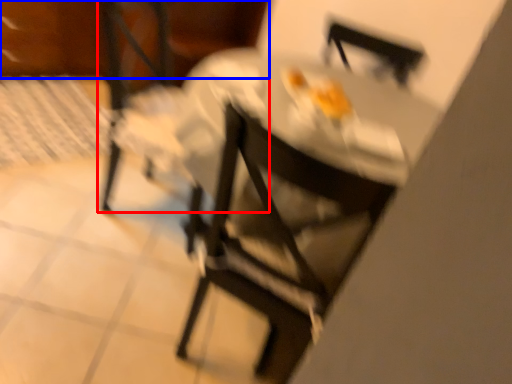
Question: Which object appears farthest to the camera in this image, chair (highlighted by a red box) or leftover (highlighted by a blue box)?

Choices:
 (A) chair
 (B) leftover

Answer: (B)